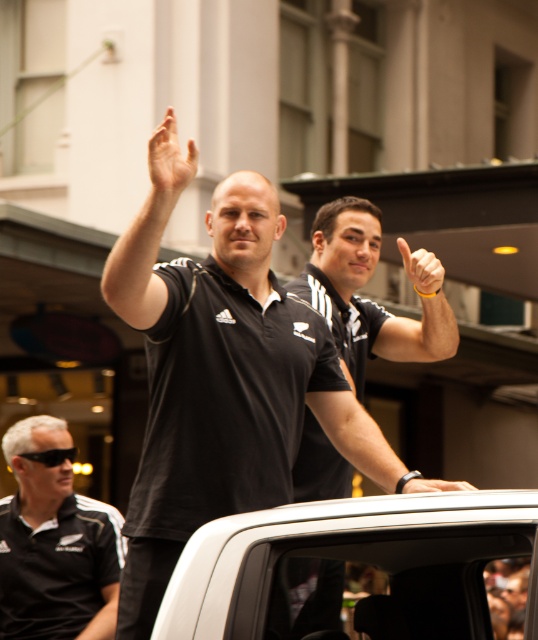
Between black matte polo shirt at center and black matte wristband at upper center, which one appears on the right side from the viewer's perspective?

From the viewer's perspective, black matte wristband at upper center appears more on the right side.

Who is lower down, black matte polo shirt at center or black matte wristband at upper center?

black matte wristband at upper center is below.

Is point (161, 356) closer to camera compared to point (407, 481)?

That is False.

Image resolution: width=538 pixels, height=640 pixels. I want to click on black matte polo shirt at center, so click(223, 401).

In the scene shown: Between black matte shirt at lower left and black matte wristband at upper center, which one is positioned lower?

black matte wristband at upper center

How much distance is there between black matte shirt at lower left and black matte wristband at upper center?

The distance of black matte shirt at lower left from black matte wristband at upper center is 13.71 feet.

Where is `black matte shirt at lower left`? Image resolution: width=538 pixels, height=640 pixels. black matte shirt at lower left is located at coordinates coord(54,541).

At what (x,y) coordinates should I click in order to perform the action: click on skinny flesh-toned hand at upper center. Please return your answer as a coordinate pair (x, y). Image resolution: width=538 pixels, height=640 pixels. Looking at the image, I should click on (169, 161).

Does skinny flesh-toned hand at upper center have a greater width compared to black matte wristband at upper center?

No.

Which is in front, point (194, 157) or point (431, 481)?

Point (431, 481)

Where is `skinny flesh-toned hand at upper center`? The width and height of the screenshot is (538, 640). skinny flesh-toned hand at upper center is located at coordinates (169, 161).